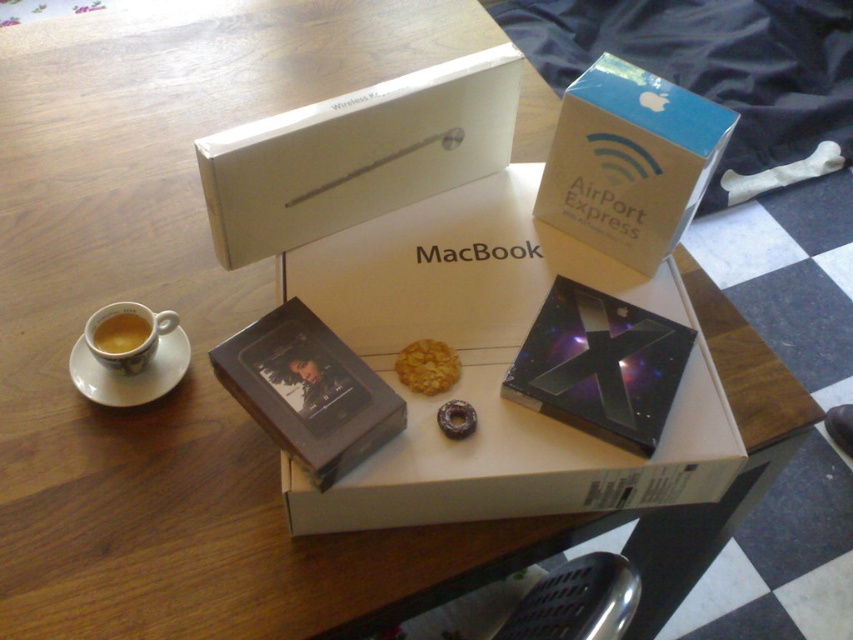
Question: Is blue cardboard box at upper right positioned before matte ceramic cup at left?

Choices:
 (A) yes
 (B) no

Answer: (A)

Question: Which point is farther from the camera taking this photo?

Choices:
 (A) (564, 499)
 (B) (132, 316)
 (C) (688, 125)

Answer: (B)

Question: Is blue cardboard box at upper right above matte ceramic cup at left?

Choices:
 (A) yes
 (B) no

Answer: (A)

Question: Which object is positioned farthest from the blue cardboard box at upper right?

Choices:
 (A) white cardboard box at center
 (B) matte ceramic cup at left

Answer: (B)

Question: Which is nearer to the matte ceramic cup at left?

Choices:
 (A) blue cardboard box at upper right
 (B) white cardboard box at center

Answer: (B)

Question: Is white cardboard box at center above blue cardboard box at upper right?

Choices:
 (A) no
 (B) yes

Answer: (A)